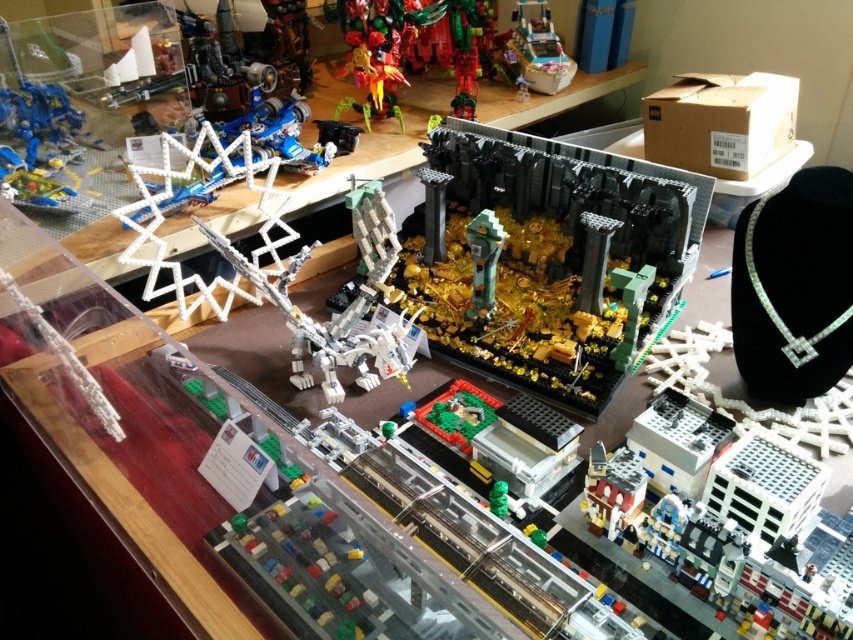
Which is behind, point (538, 388) or point (566, 52)?

The point (566, 52) is more distant.

Can you confirm if dark gray stone structure at center is positioned above metallic silver car at upper right?

No.

Where is `dark gray stone structure at center`? The image size is (853, 640). dark gray stone structure at center is located at coordinates (550, 260).